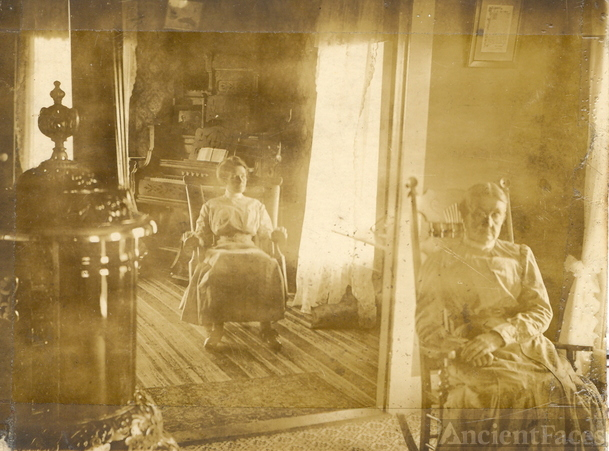
Locate an element on the screen. Image resolution: width=609 pixels, height=451 pixels. chair is located at coordinates (198, 187), (448, 229).